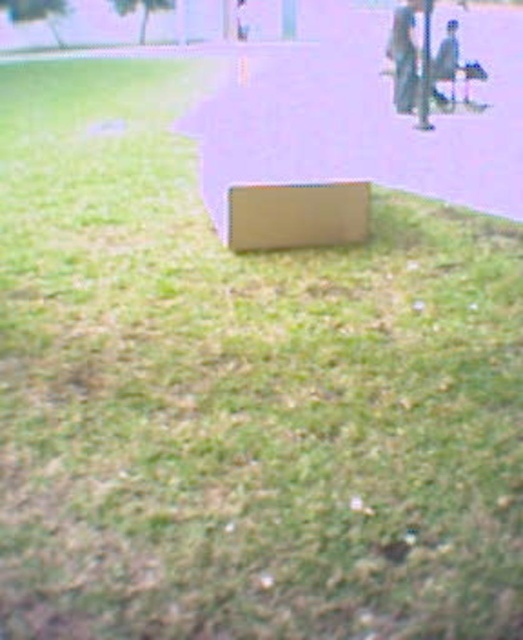
You are standing on the grassy area and want to place the metallic silver skateboard at upper right on top of the matte cardboard box at center. Is this possible given their positions?

The matte cardboard box at center is in front of the metallic silver skateboard at upper right, so placing the skateboard on top of the box would not be possible since the box is closer to you and the skateboard is behind it.

Consider the image. You are a delivery person who needs to place a small package on the grassy area. The matte cardboard box at center is already there. Can you place the metallic silver skateboard at upper right next to it without overlapping?

The matte cardboard box at center has a larger width than the metallic silver skateboard at upper right. Since the box is wider, there should be enough space to place the skateboard next to it without overlapping.